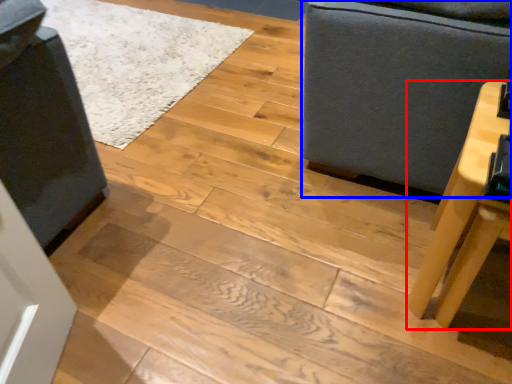
Question: Which object is closer to the camera taking this photo, table (highlighted by a red box) or furniture (highlighted by a blue box)?

Choices:
 (A) table
 (B) furniture

Answer: (A)